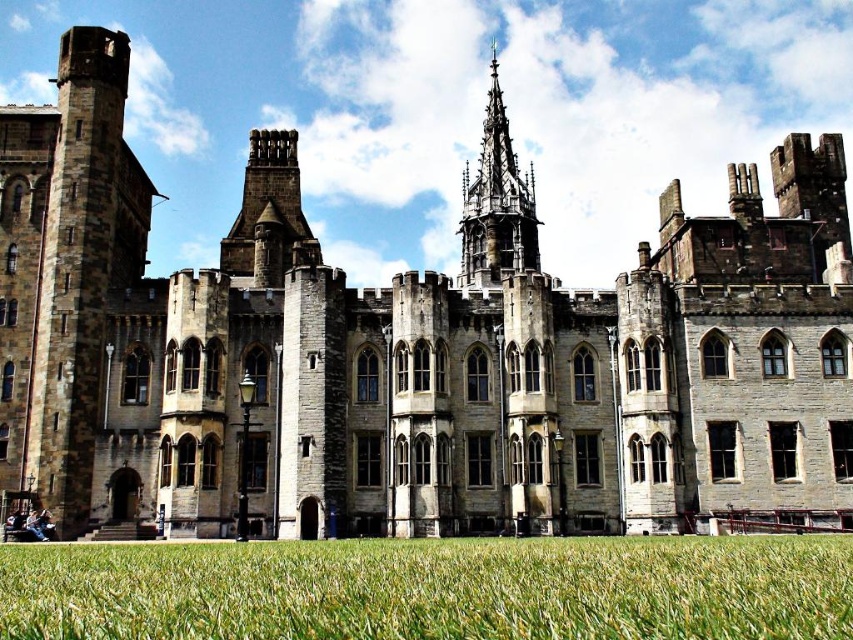
Can you confirm if green grass at lower center is bigger than stone gothic tower at center?

No, green grass at lower center is not bigger than stone gothic tower at center.

Based on the photo, is green grass at lower center further to camera compared to stone gothic tower at center?

No.

Does point (743, 536) come in front of point (461, 212)?

Yes, it is in front of point (461, 212).

Identify the location of green grass at lower center. (432, 589).